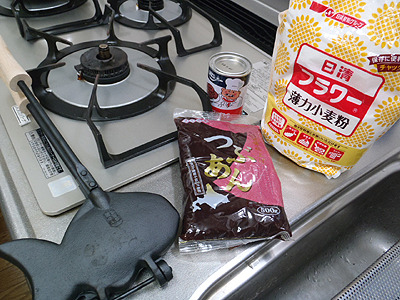
Where is `rim of burner`? This screenshot has height=300, width=400. rim of burner is located at coordinates (42, 95), (76, 46), (155, 51), (136, 105), (133, 24), (181, 20).